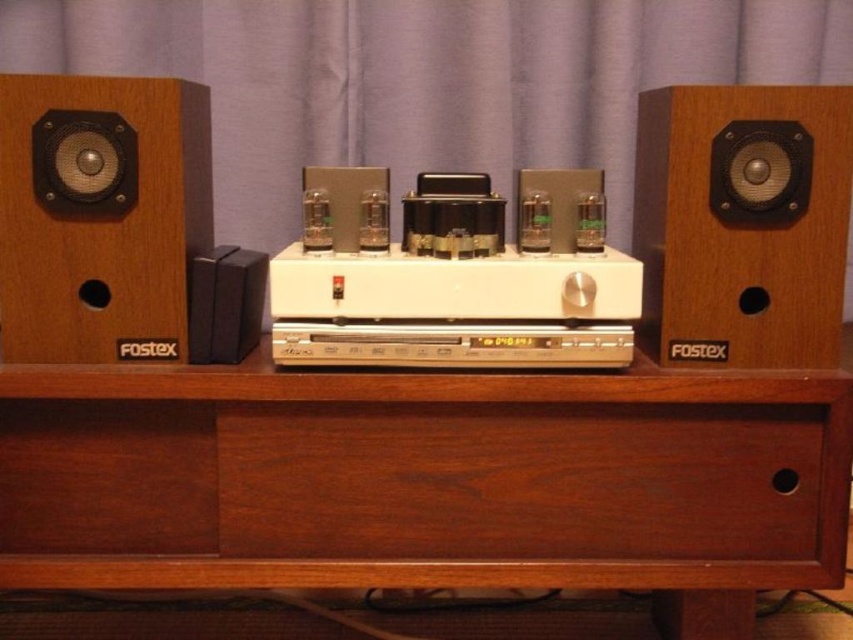
You are standing in front of the vintage audio setup. You notice two points marked on the image. Which point is closer to you, point (759,497) or point (595,314)?

Point (759,497) is closer to you than point (595,314).

You are setting up a new audio system and need to place both the brown wood drawer at center and the white plastic stereo at center on a shelf that can only accommodate one item. Which item should you choose to fit the shelf?

The brown wood drawer at center is wider than the white plastic stereo at center, so you should choose the white plastic stereo at center to fit the shelf.

You are setting up a home theater system and need to connect the white plastic stereo at center to the brown wood drawer at center. Based on their positions, which one should you plug the cable into first?

The white plastic stereo at center is behind the brown wood drawer at center, so you should plug the cable into the brown wood drawer at center first to avoid having to reach behind the stereo.